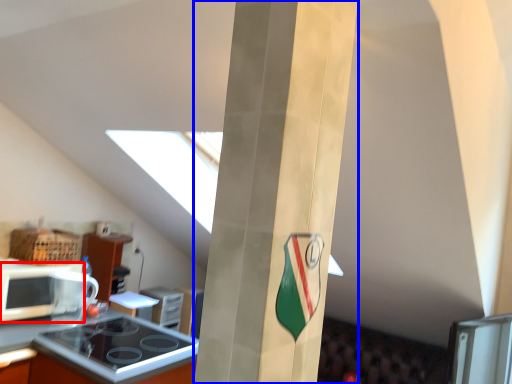
Question: Which object appears farthest to the camera in this image, microwave oven (highlighted by a red box) or pillar (highlighted by a blue box)?

Choices:
 (A) microwave oven
 (B) pillar

Answer: (A)